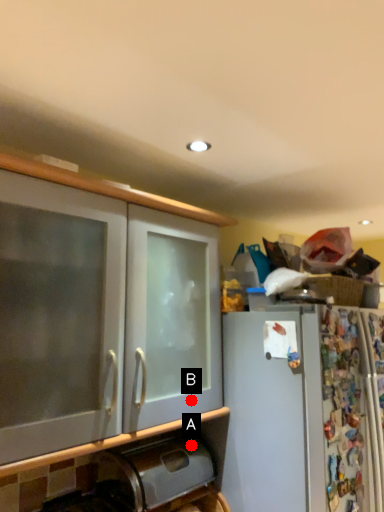
Question: Two points are circled on the image, labeled by A and B beside each circle. Among these points, which one is farthest from the camera?

Choices:
 (A) A is further
 (B) B is further

Answer: (A)